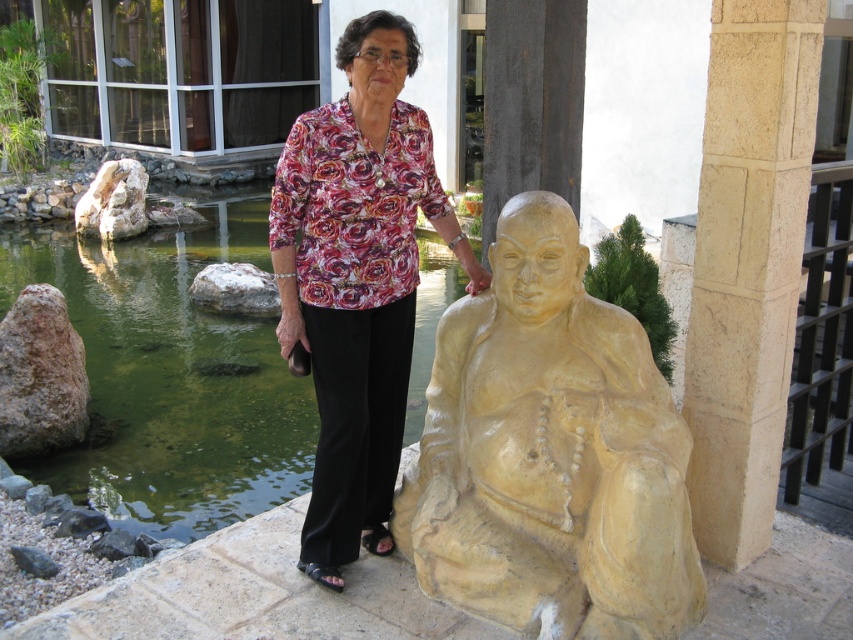
You are a photographer trying to capture the best angle of the scene. You notice two specific points in the image at coordinates point (448, 595) and point (422, 186). Based on their positions, which point is closer to the camera?

Point (448, 595) is in front of point (422, 186), so it is closer to the camera.

You are a photographer setting up for a shoot. You need to ensure that the yellow stone statue at center and the floral fabric blouse at center are visible in the frame. Based on their positions, which object is closer to the camera?

The floral fabric blouse at center is closer to the camera because the yellow stone statue at center is positioned under it, indicating it is behind the blouse.